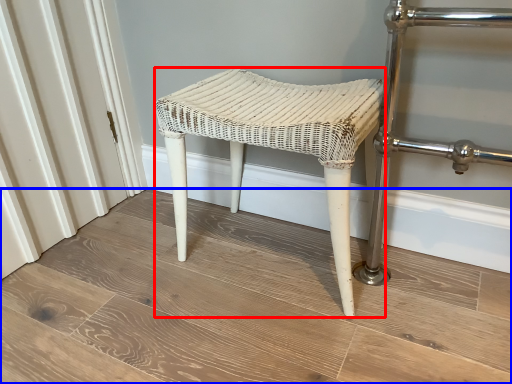
Question: Which object appears closest to the camera in this image, stool (highlighted by a red box) or plank (highlighted by a blue box)?

Choices:
 (A) stool
 (B) plank

Answer: (B)